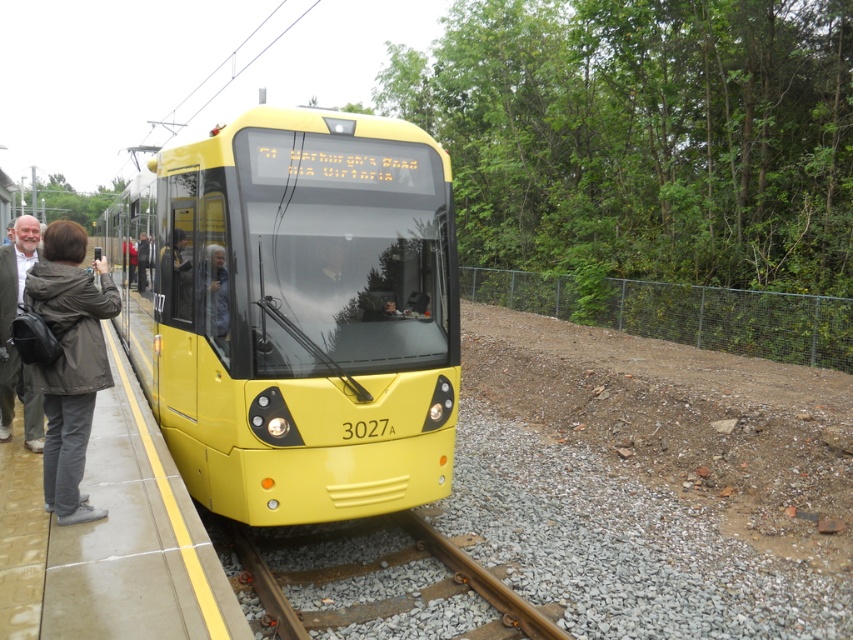
Question: Is yellow matte train at center thinner than dark gray fabric jacket at left?

Choices:
 (A) yes
 (B) no

Answer: (B)

Question: Among these points, which one is farthest from the camera?

Choices:
 (A) (474, 632)
 (B) (27, 300)
 (C) (9, 364)
 (D) (445, 419)

Answer: (C)

Question: Where is brown wooden train track at center located in relation to dark gray fabric jacket at left in the image?

Choices:
 (A) right
 (B) left

Answer: (A)

Question: Which object appears closest to the camera in this image?

Choices:
 (A) light brown leather jacket at left
 (B) brown wooden train track at center
 (C) yellow matte train at center

Answer: (B)

Question: Is brown wooden train track at center positioned in front of dark gray fabric jacket at left?

Choices:
 (A) yes
 (B) no

Answer: (A)

Question: Which point is closer to the camera?

Choices:
 (A) (180, 384)
 (B) (100, 298)

Answer: (B)